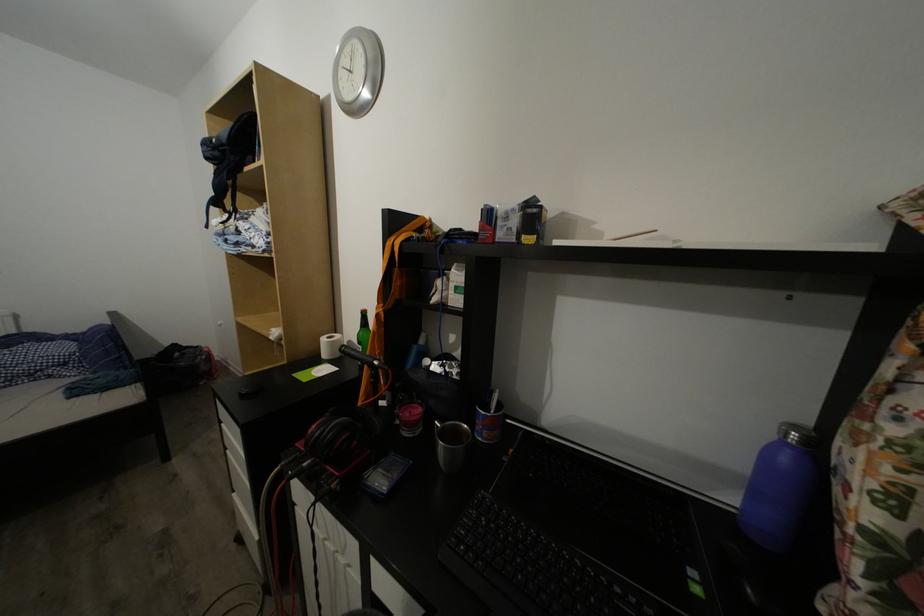
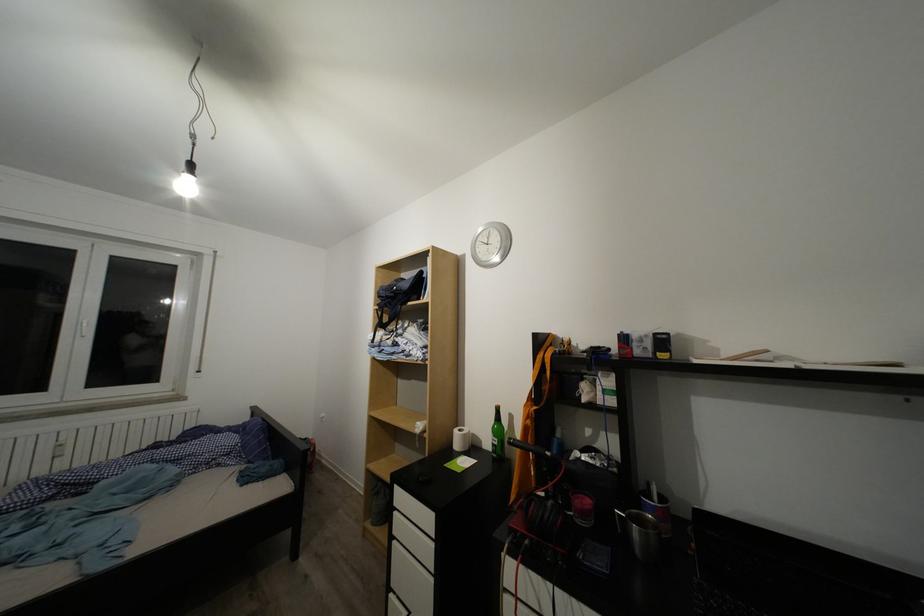
Find the pixel in the second image that matches pixel 418 431 in the first image.

(590, 520)